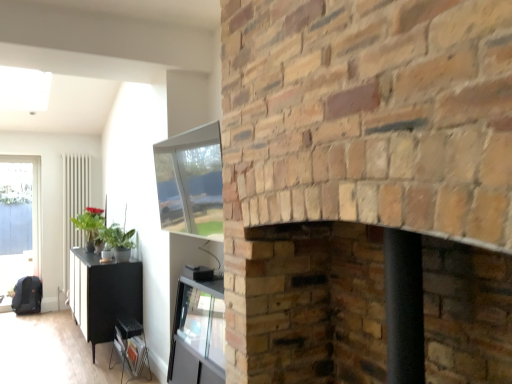
Where is `black matte cabinet at lower left`? black matte cabinet at lower left is located at coordinates coord(104,294).

In order to face black matte cabinet at lower left, should I rotate leftwards or rightwards?

Turn left by 20.038 degrees to look at black matte cabinet at lower left.

Measure the distance between point (347, 4) and camera.

They are 4.25 feet apart.

I want to click on transparent glass door at left, so click(x=19, y=219).

Where is `black matte cabinet at lower left`? This screenshot has height=384, width=512. black matte cabinet at lower left is located at coordinates (104, 294).

Does transparent glass door at left lie behind white glossy radiator at left?

No, transparent glass door at left is closer to the camera.

In order to click on window on the left of white glossy radiator at left in this screenshot , I will do `click(19, 219)`.

Is white glossy radiator at left at the back of transparent glass door at left?

That's not correct — transparent glass door at left is not looking away from white glossy radiator at left.

Considering the positions of point (40, 235) and point (72, 194), is point (40, 235) closer or farther from the camera than point (72, 194)?

Point (40, 235) is closer to the camera than point (72, 194).

Relative to green matte plant at left, is black matte cabinet at lower left in front or behind?

In the image, black matte cabinet at lower left appears in front of green matte plant at left.

Can you tell me how much black matte cabinet at lower left and green matte plant at left differ in facing direction?

The facing directions of black matte cabinet at lower left and green matte plant at left are 0.301 degrees apart.

Would you say black matte cabinet at lower left is inside or outside green matte plant at left?

black matte cabinet at lower left is located beyond the bounds of green matte plant at left.

From a real-world perspective, who is located lower, black matte cabinet at lower left or green matte plant at left?

In real-world perspective, black matte cabinet at lower left is lower.

Considering the sizes of objects black matte cabinet at lower left and brick fireplace at center, the second fireplace ordered from the bottom, in the image provided, who is shorter, black matte cabinet at lower left or brick fireplace at center, the second fireplace ordered from the bottom,?

With less height is black matte cabinet at lower left.

Between black matte cabinet at lower left and brick fireplace at center, arranged as the first fireplace when viewed from the top, which one has smaller size?

With smaller size is black matte cabinet at lower left.

From the image's perspective, does black matte cabinet at lower left appear lower than brick fireplace at center, arranged as the first fireplace when viewed from the top?

Yes, from the image's perspective, black matte cabinet at lower left is below brick fireplace at center, arranged as the first fireplace when viewed from the top.

Are black matte cabinet at lower left and brick fireplace at center, arranged as the first fireplace when viewed from the top, making contact?

No, black matte cabinet at lower left is not in contact with brick fireplace at center, arranged as the first fireplace when viewed from the top.

Is brick fireplace at center, arranged as the first fireplace when viewed from the top, in front of smooth brick fireplace at center, acting as the second fireplace starting from the top?

That is True.

Is brick fireplace at center, arranged as the first fireplace when viewed from the top, outside of smooth brick fireplace at center, which ranks as the 1th fireplace in bottom-to-top order?

That's correct, brick fireplace at center, arranged as the first fireplace when viewed from the top, is outside of smooth brick fireplace at center, which ranks as the 1th fireplace in bottom-to-top order.

Based on the photo, considering the sizes of objects brick fireplace at center, the second fireplace ordered from the bottom, and smooth brick fireplace at center, which ranks as the 1th fireplace in bottom-to-top order, in the image provided, who is wider, brick fireplace at center, the second fireplace ordered from the bottom, or smooth brick fireplace at center, which ranks as the 1th fireplace in bottom-to-top order,?

With larger width is brick fireplace at center, the second fireplace ordered from the bottom.

Can you tell me how much brick fireplace at center, the second fireplace ordered from the bottom, and smooth brick fireplace at center, acting as the second fireplace starting from the top, differ in facing direction?

The angle between the facing direction of brick fireplace at center, the second fireplace ordered from the bottom, and the facing direction of smooth brick fireplace at center, acting as the second fireplace starting from the top, is 0.000506 degrees.

Is white glossy radiator at left facing away from green matte plant at left?

Correct, white glossy radiator at left is looking away from green matte plant at left.

Does white glossy radiator at left have a lesser height compared to green matte plant at left?

In fact, white glossy radiator at left may be taller than green matte plant at left.

From the image's perspective, relative to green matte plant at left, is white glossy radiator at left above or below?

white glossy radiator at left is below green matte plant at left.

Is green matte plant at left surrounded by white glossy radiator at left?

No, green matte plant at left is not inside white glossy radiator at left.

Which of these two, brick fireplace at center, the second fireplace ordered from the bottom, or green matte plant at left, is smaller?

Smaller between the two is green matte plant at left.

From a real-world perspective, is brick fireplace at center, arranged as the first fireplace when viewed from the top, over green matte plant at left?

Yes, from a real-world perspective, brick fireplace at center, arranged as the first fireplace when viewed from the top, is on top of green matte plant at left.

Is brick fireplace at center, the second fireplace ordered from the bottom, oriented towards green matte plant at left?

No, brick fireplace at center, the second fireplace ordered from the bottom, is not aimed at green matte plant at left.

Which is in front, point (477, 248) or point (85, 214)?

The point (477, 248) is closer to the camera.

From the picture: Is green matte plant at left thinner than black matte cabinet at lower left?

Indeed, green matte plant at left has a lesser width compared to black matte cabinet at lower left.

Between point (87, 217) and point (82, 300), which one is positioned behind?

The point (87, 217) is farther from the camera.

How many degrees apart are the facing directions of green matte plant at left and black matte cabinet at lower left?

The angle between the facing direction of green matte plant at left and the facing direction of black matte cabinet at lower left is 0.301 degrees.

From the picture: Is green matte plant at left to the right of black matte cabinet at lower left from the viewer's perspective?

No.

The image size is (512, 384). Identify the location of window in front of the white glossy radiator at left. (19, 219).

Where is `plant that is above the black matte cabinet at lower left (from a real-world perspective)`? plant that is above the black matte cabinet at lower left (from a real-world perspective) is located at coordinates coord(90,225).

Considering their positions, is green matte plant at left positioned further to smooth brick fireplace at center, acting as the second fireplace starting from the top, than black matte cabinet at lower left?

The object further to smooth brick fireplace at center, acting as the second fireplace starting from the top, is green matte plant at left.

Looking at the image, which one is located closer to green matte plant at left, brick fireplace at center, arranged as the first fireplace when viewed from the top, or smooth brick fireplace at center, which ranks as the 1th fireplace in bottom-to-top order?

smooth brick fireplace at center, which ranks as the 1th fireplace in bottom-to-top order, is closer to green matte plant at left.

Based on their spatial positions, is transparent glass door at left or black matte cabinet at lower left closer to smooth brick fireplace at center, acting as the second fireplace starting from the top?

black matte cabinet at lower left.

Looking at the image, which one is located further to transparent glass door at left, brick fireplace at center, the second fireplace ordered from the bottom, or green matte plant at left?

Based on the image, brick fireplace at center, the second fireplace ordered from the bottom, appears to be further to transparent glass door at left.

Looking at the image, which one is located closer to black matte cabinet at lower left, green matte plant at left or smooth brick fireplace at center, which ranks as the 1th fireplace in bottom-to-top order?

Based on the image, green matte plant at left appears to be nearer to black matte cabinet at lower left.

Which object lies nearer to the anchor point black matte cabinet at lower left, smooth brick fireplace at center, which ranks as the 1th fireplace in bottom-to-top order, or white glossy radiator at left?

white glossy radiator at left is closer to black matte cabinet at lower left.

Considering their positions, is transparent glass door at left positioned further to brick fireplace at center, arranged as the first fireplace when viewed from the top, than black matte cabinet at lower left?

Among the two, transparent glass door at left is located further to brick fireplace at center, arranged as the first fireplace when viewed from the top.

Estimate the real-world distances between objects in this image. Which object is further from brick fireplace at center, the second fireplace ordered from the bottom, transparent glass door at left or smooth brick fireplace at center, which ranks as the 1th fireplace in bottom-to-top order?

transparent glass door at left.

In order to click on plant positioned between brick fireplace at center, arranged as the first fireplace when viewed from the top, and white glossy radiator at left from near to far in this screenshot , I will do `click(90, 225)`.

Find the location of a particular element. table located between brick fireplace at center, the second fireplace ordered from the bottom, and transparent glass door at left in the depth direction is located at coordinates (104, 294).

At what (x,y) coordinates should I click in order to perform the action: click on plant located between smooth brick fireplace at center, acting as the second fireplace starting from the top, and transparent glass door at left in the depth direction. Please return your answer as a coordinate pair (x, y). Looking at the image, I should click on click(90, 225).

At what (x,y) coordinates should I click in order to perform the action: click on plant between black matte cabinet at lower left and white glossy radiator at left along the z-axis. Please return your answer as a coordinate pair (x, y). The height and width of the screenshot is (384, 512). Looking at the image, I should click on (90, 225).